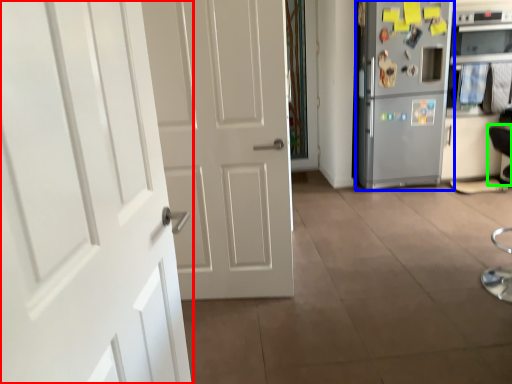
Question: Which object is the closest to the door (highlighted by a red box)? Choose among these: refrigerator (highlighted by a blue box) or armchair (highlighted by a green box).

Choices:
 (A) refrigerator
 (B) armchair

Answer: (A)